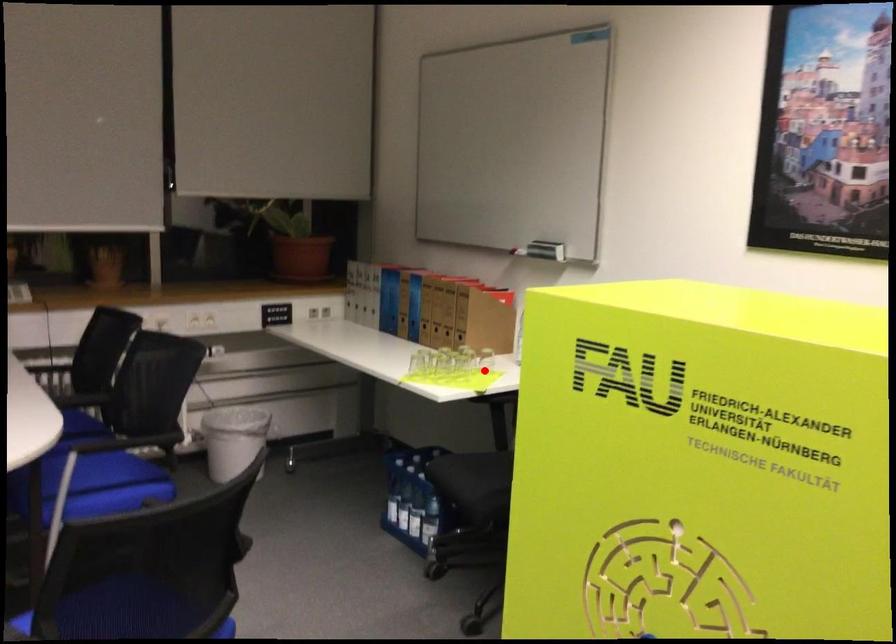
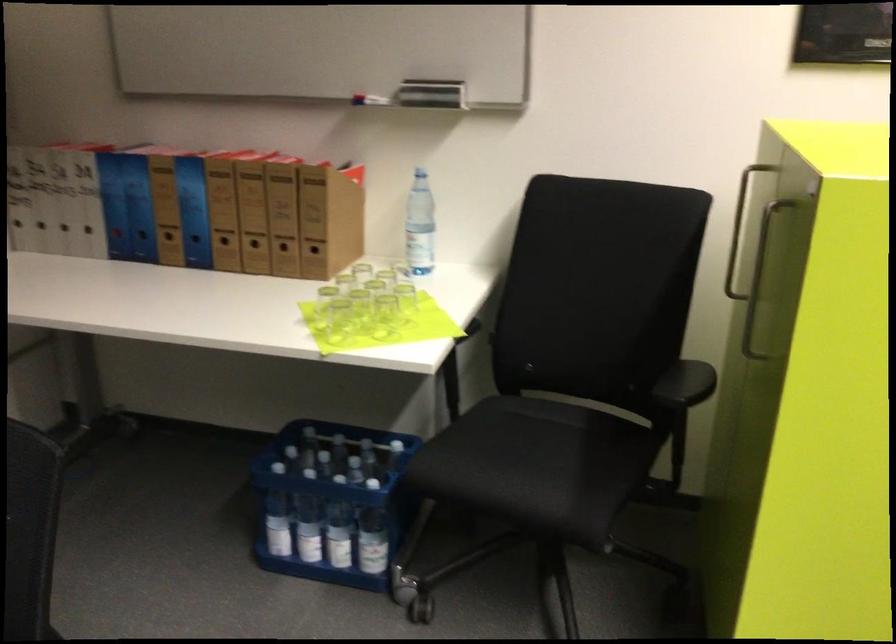
Where in the second image is the point corresponding to the highlighted location from the first image?

(405, 299)